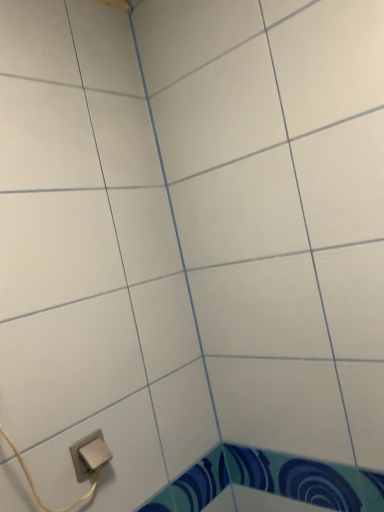
This screenshot has width=384, height=512. Describe the element at coordinates (89, 455) in the screenshot. I see `satin silver plug at lower left` at that location.

What is the approximate height of satin silver plug at lower left?

satin silver plug at lower left is 9.83 centimeters in height.

Find the location of `satin silver plug at lower left`. satin silver plug at lower left is located at coordinates (89, 455).

The height and width of the screenshot is (512, 384). I want to click on satin silver plug at lower left, so click(89, 455).